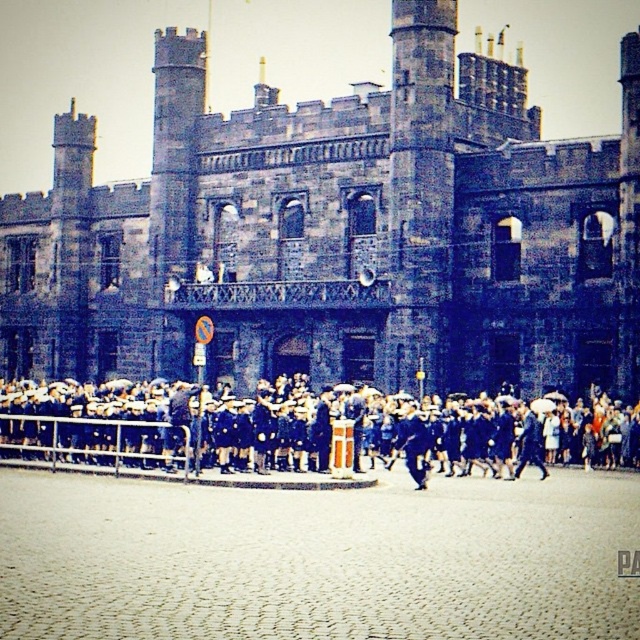
You are an architect designing a scale model of the historical scene. The dark stone castle at center and the dark blue uniforms at center must be included. If the castle model is 20 cm wide, what is the maximum width the uniforms model can be to maintain proper proportions?

The dark stone castle at center is wider than the dark blue uniforms at center. If the castle model is 20 cm wide, the uniforms model must be narrower than 20 cm to maintain proper proportions.

You are a guest attending an event at the castle. You need to walk from the dark stone castle at center to the dark blue uniforms at center. How far will you have to walk?

The dark stone castle at center is 9.11 meters from dark blue uniforms at center, so you will have to walk 9.11 meters to reach them.

You are an attendee at a ceremony in front of the dark stone castle at center and the dark blue uniforms at center. From your perspective facing the castle, which object is positioned to your left?

The dark blue uniforms at center are positioned to your left since the dark stone castle at center is to the right of them.